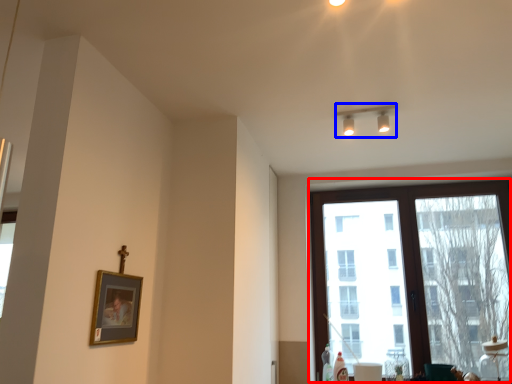
Question: Which object appears farthest to the camera in this image, window (highlighted by a red box) or lamp (highlighted by a blue box)?

Choices:
 (A) window
 (B) lamp

Answer: (A)